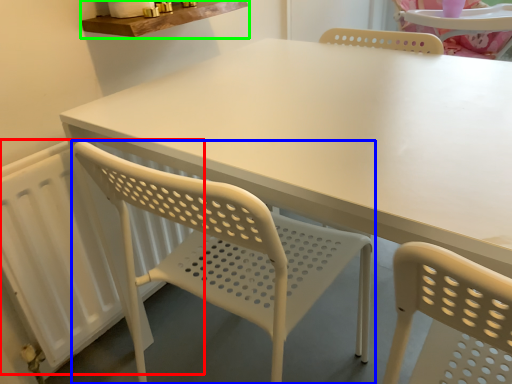
Question: Which object is positioned closest to radiator (highlighted by a red box)? Select from chair (highlighted by a blue box) and counter top (highlighted by a green box).

Choices:
 (A) chair
 (B) counter top

Answer: (A)